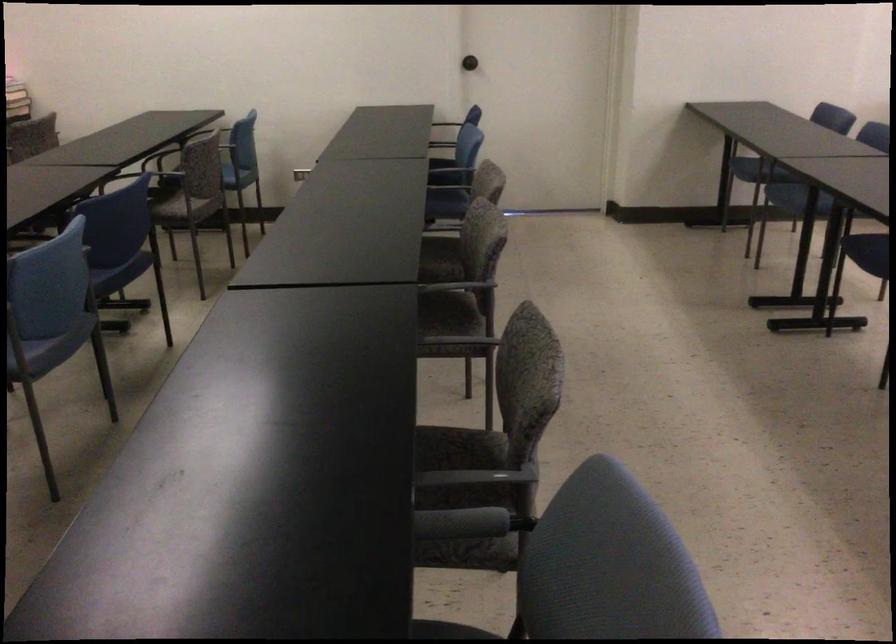
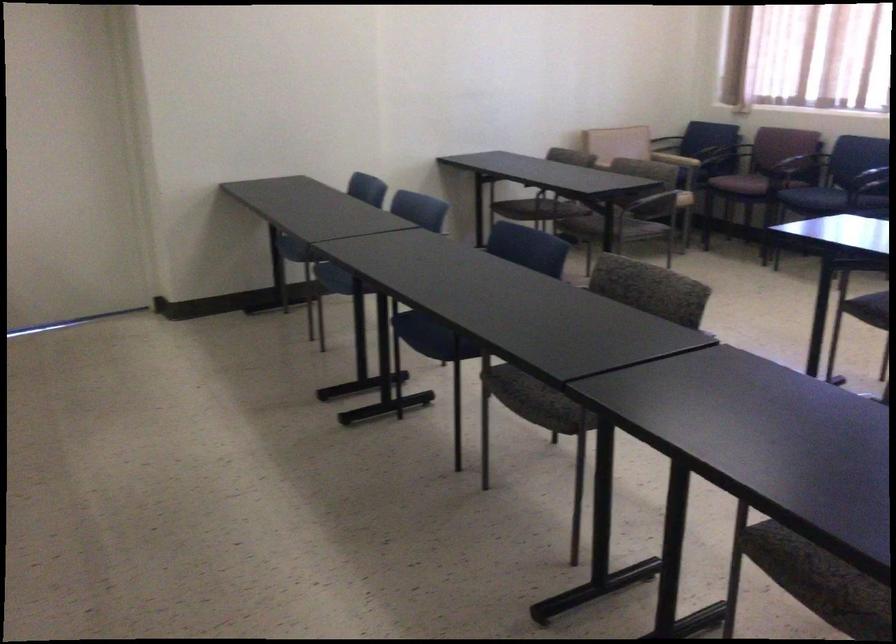
Locate, in the second image, the point that corresponds to the point at 743,154 in the first image.

(295, 252)